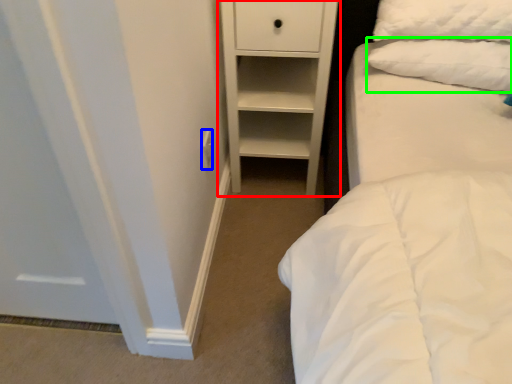
Question: Based on their relative distances, which object is farther from chest of drawers (highlighted by a red box)? Choose from electric outlet (highlighted by a blue box) and pillow (highlighted by a green box).

Choices:
 (A) electric outlet
 (B) pillow

Answer: (A)